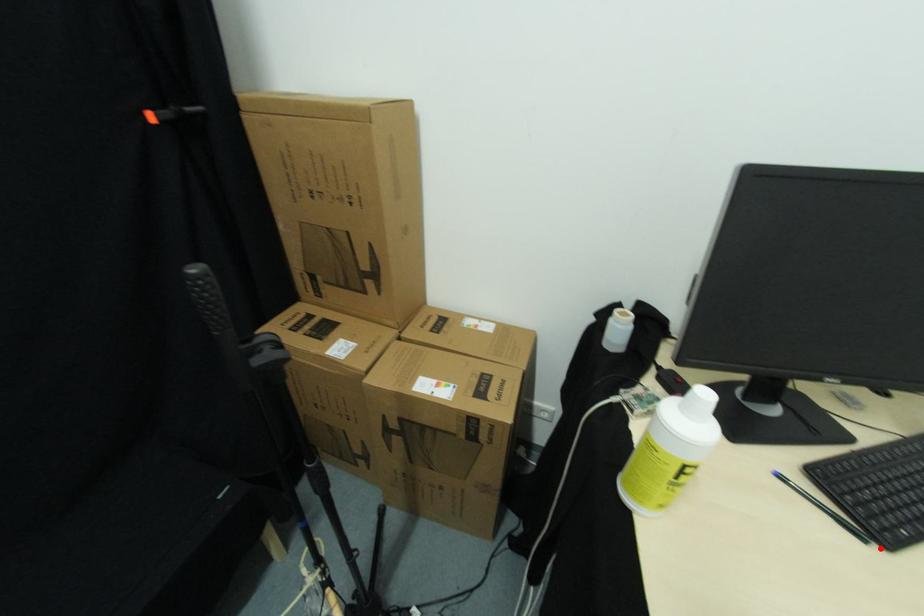
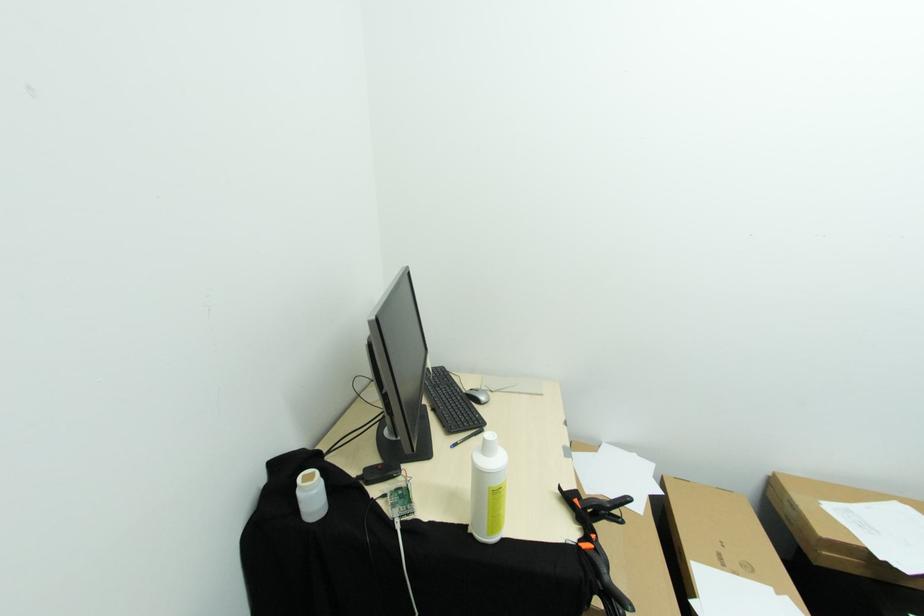
Locate, in the second image, the point that corresponds to the highlighted location in the first image.

(487, 431)